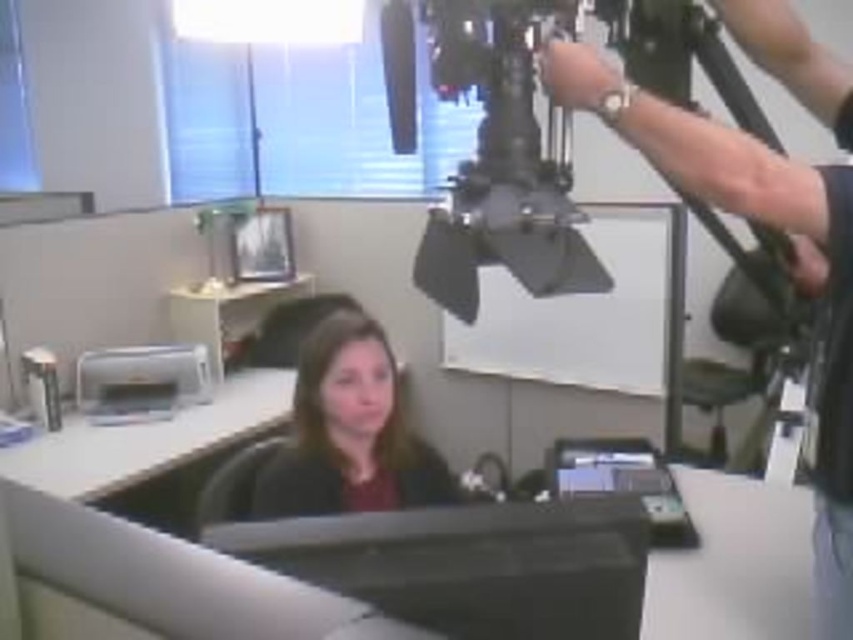
Based on the photo, is metallic silver tripod at upper right taller than matte black shirt at center?

Yes.

The width and height of the screenshot is (853, 640). What do you see at coordinates (792, 266) in the screenshot?
I see `metallic silver tripod at upper right` at bounding box center [792, 266].

Identify the location of metallic silver tripod at upper right. Image resolution: width=853 pixels, height=640 pixels. (792, 266).

This screenshot has width=853, height=640. What do you see at coordinates (792, 266) in the screenshot?
I see `metallic silver tripod at upper right` at bounding box center [792, 266].

Locate an element on the screen. The height and width of the screenshot is (640, 853). metallic silver tripod at upper right is located at coordinates (792, 266).

Can you confirm if black glossy monitor at center is positioned to the left of matte black shirt at center?

In fact, black glossy monitor at center is to the right of matte black shirt at center.

Which of these two, black glossy monitor at center or matte black shirt at center, stands shorter?

Standing shorter between the two is black glossy monitor at center.

Between point (639, 596) and point (372, 442), which one is positioned behind?

The point (372, 442) is more distant.

The image size is (853, 640). Identify the location of black glossy monitor at center. (469, 564).